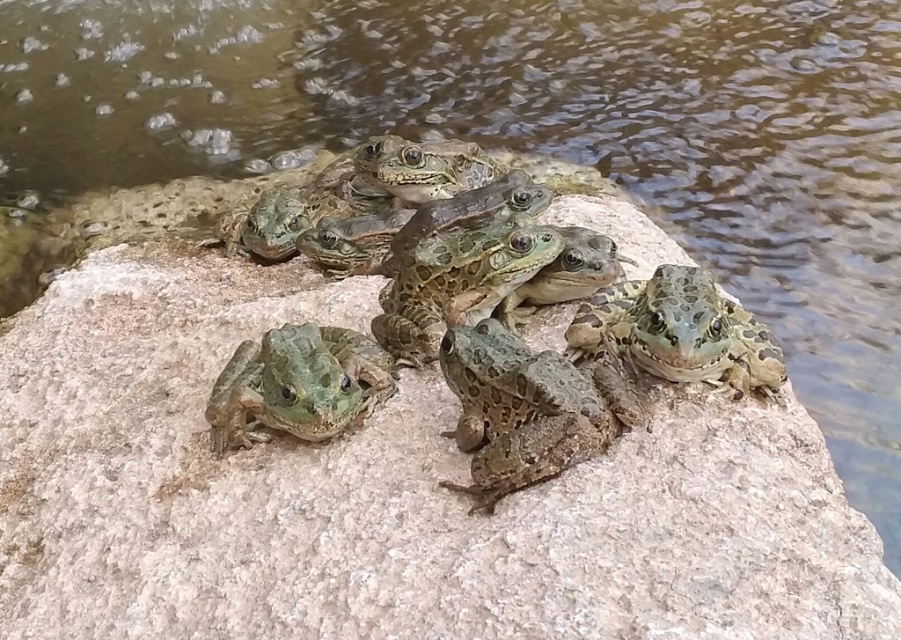
You are a frog observer trying to determine the positions of two points on the rock where frogs are sitting. Based on the image, which point is closer to you, point (244, 344) or point (257, 422)?

Point (244, 344) is further to the viewer than point (257, 422), so point (257, 422) is closer to you.

You are a nature photographer observing frogs on a rock. You notice a speckled brown skin at center and a green textured frog at center. Which frog is positioned to the right of the other?

The speckled brown skin at center is positioned to the right of the green textured frog at center.

You are a herpetologist observing the frogs on the rock. You need to distinguish between the green spotted frogs at center and the green textured frog at center based on their size. Which frog has a larger width?

The green spotted frogs at center has a larger width than the green textured frog at center.